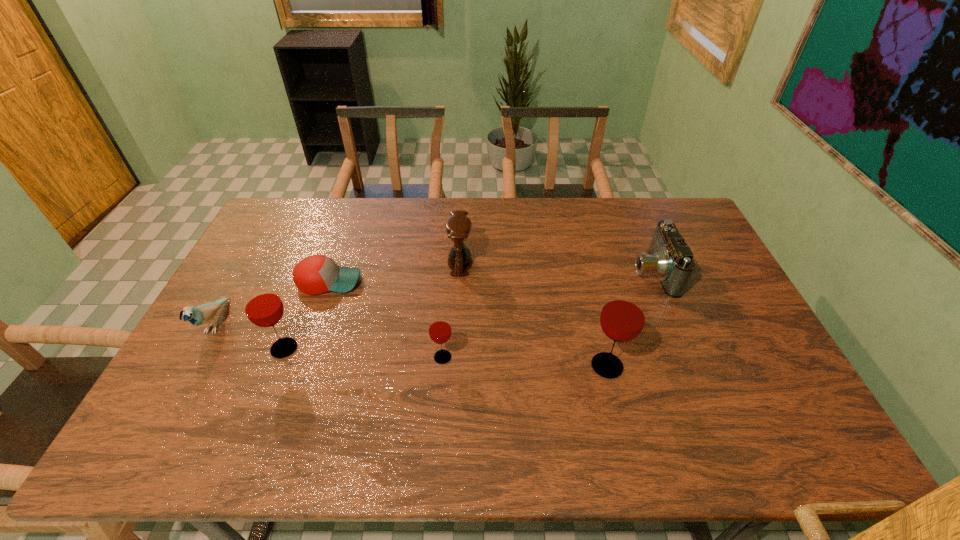
This screenshot has width=960, height=540. What are the coordinates of `the sixth shortest object` in the screenshot? It's located at (264, 308).

You are a GUI agent. You are given a task and a screenshot of the screen. Output one action in this format:
    pyautogui.click(x=<x>, y=<y>)
    Task: Click on the second tallest glass
    
    Given the screenshot: What is the action you would take?
    pyautogui.click(x=264, y=308)

This screenshot has height=540, width=960. In order to click on the shortest glass in this screenshot , I will do `click(439, 329)`.

Where is `the rightmost glass`? The width and height of the screenshot is (960, 540). the rightmost glass is located at coordinates (622, 319).

I want to click on the rightmost object, so pyautogui.click(x=670, y=258).

The height and width of the screenshot is (540, 960). Identify the location of baseball cap. (316, 274).

The image size is (960, 540). I want to click on bird, so click(x=202, y=314).

In order to click on hourglass in this screenshot , I will do `click(458, 227)`.

In order to click on free spot located on the back of the second tallest glass in this screenshot , I will do `click(318, 262)`.

I want to click on vacant space located 0.160m on the left of the second glass from left to right, so click(372, 357).